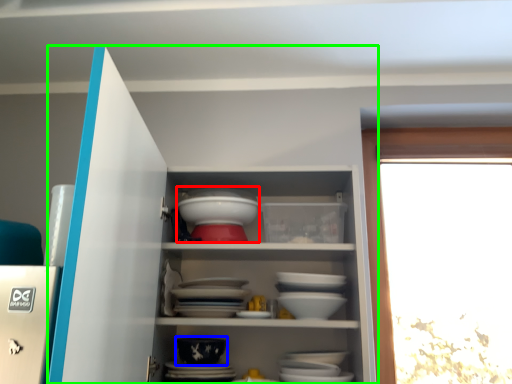
Question: Which object is the closest to the tableware (highlighted by a red box)? Choose among these: bowl (highlighted by a blue box) or cupboard (highlighted by a green box).

Choices:
 (A) bowl
 (B) cupboard

Answer: (B)